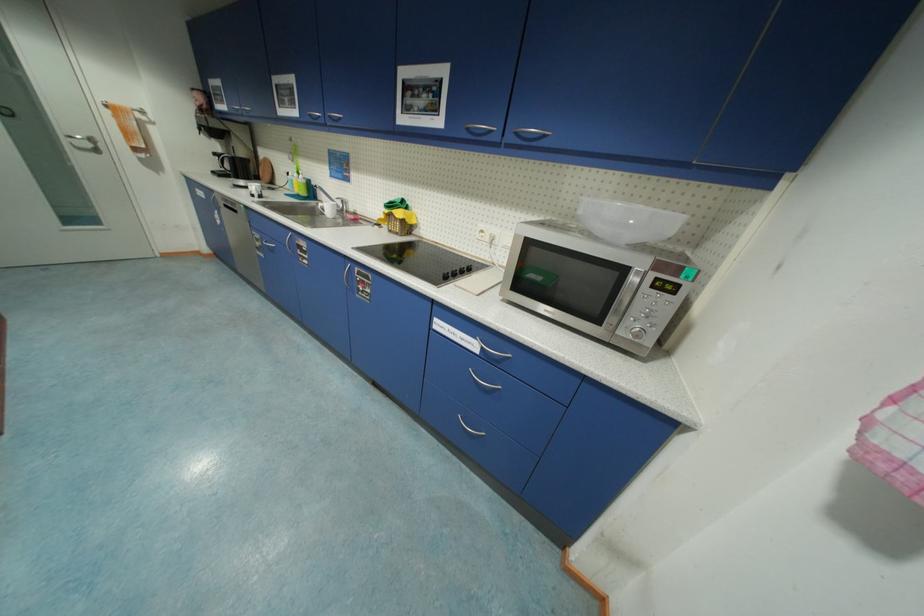
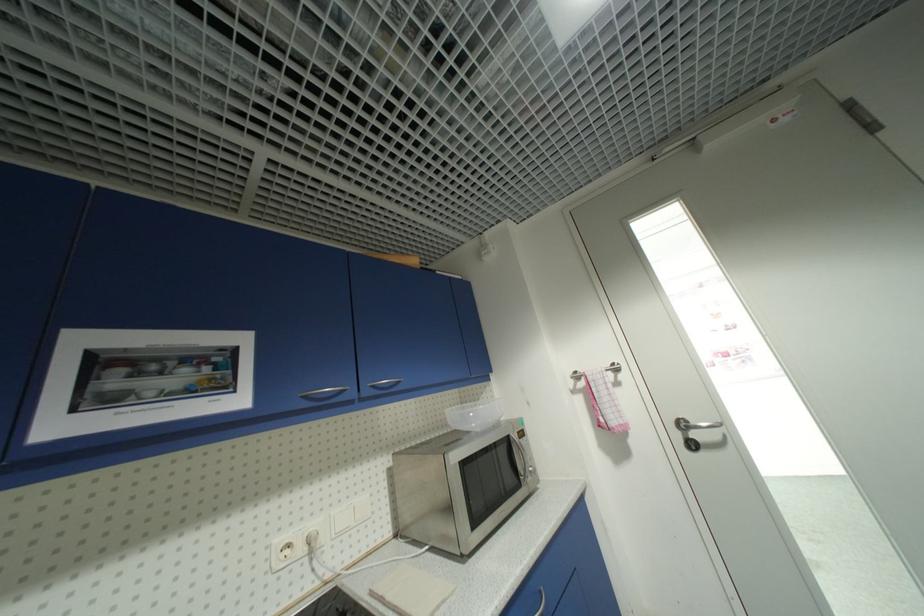
Question: How did the camera likely rotate?

Choices:
 (A) Left
 (B) Right
 (C) Up
 (D) Down

Answer: (B)